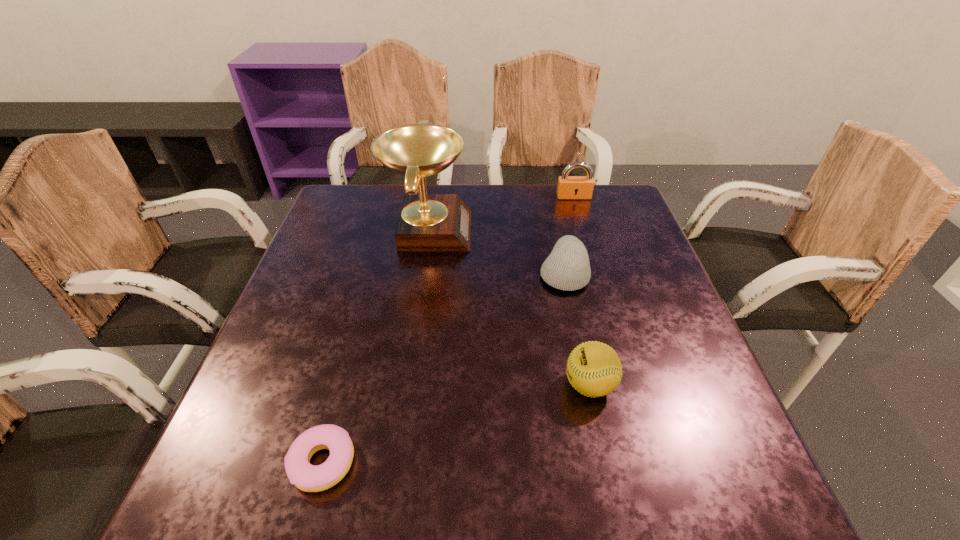
The width and height of the screenshot is (960, 540). I want to click on unoccupied position between the nearest object and the beanie, so click(x=443, y=368).

Image resolution: width=960 pixels, height=540 pixels. I want to click on free space between the shortest object and the award, so click(x=375, y=346).

Find the location of `vacant space that's between the tallest object and the beanie`. vacant space that's between the tallest object and the beanie is located at coordinates (496, 251).

The height and width of the screenshot is (540, 960). I want to click on vacant area between the doughnut and the tallest object, so [x=375, y=346].

Locate an element on the screen. This screenshot has width=960, height=540. free area in between the nearest object and the beanie is located at coordinates (443, 368).

Image resolution: width=960 pixels, height=540 pixels. I want to click on vacant space that is in between the softball and the beanie, so click(x=577, y=329).

What are the coordinates of `free space between the second nearest object and the beanie` in the screenshot? It's located at (577, 329).

Point out which object is positioned as the nearest to the second nearest object. Please provide its 2D coordinates. Your answer should be formatted as a tuple, i.e. [(x, y)], where the tuple contains the x and y coordinates of a point satisfying the conditions above.

[(567, 268)]

Identify which object is the fourth closest to the shortest object. Please provide its 2D coordinates. Your answer should be formatted as a tuple, i.e. [(x, y)], where the tuple contains the x and y coordinates of a point satisfying the conditions above.

[(569, 187)]

Locate an element on the screen. The height and width of the screenshot is (540, 960). free spot that satisfies the following two spatial constraints: 1. on the front-facing side of the tallest object; 2. on the left side of the beanie is located at coordinates (421, 273).